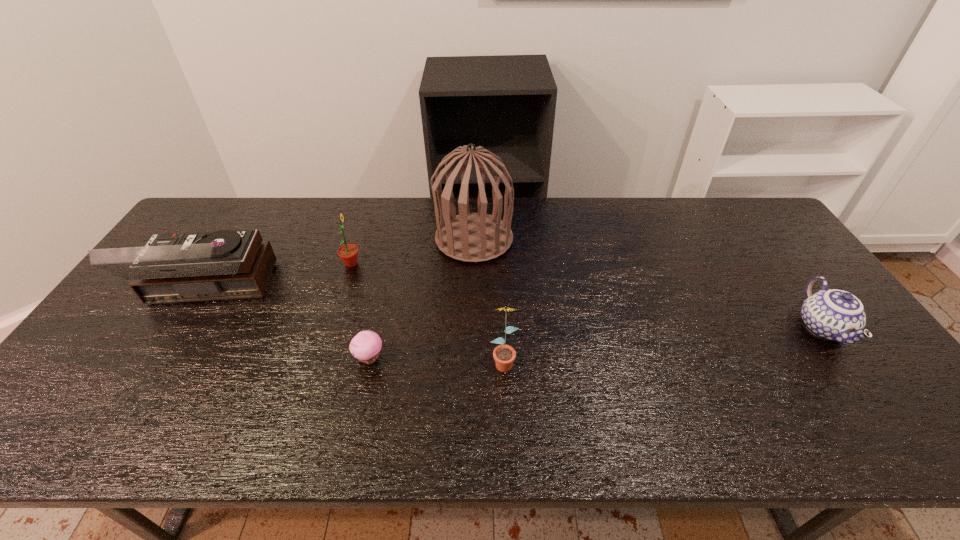
This screenshot has width=960, height=540. What are the coordinates of `vacant space at the near edge of the desktop` in the screenshot? It's located at (769, 418).

In the image, there is a desktop. Identify the location of blank space at the right edge. The image size is (960, 540). (790, 293).

Locate an element on the screen. The width and height of the screenshot is (960, 540). vacant region at the far left corner of the desktop is located at coordinates 205,222.

Locate an element on the screen. free space at the far right corner of the desktop is located at coordinates (736, 199).

At what (x,y) coordinates should I click in order to perform the action: click on free area in between the tallest object and the record player. Please return your answer as a coordinate pair (x, y). The width and height of the screenshot is (960, 540). Looking at the image, I should click on (342, 266).

Locate an element on the screen. vacant space that's between the record player and the tallest object is located at coordinates (342, 266).

You are a GUI agent. You are given a task and a screenshot of the screen. Output one action in this format:
    pyautogui.click(x=<x>, y=<y>)
    Task: Click on the vacant area between the leftmost object and the fifth tallest object
    The width and height of the screenshot is (960, 540).
    Given the screenshot: What is the action you would take?
    pyautogui.click(x=516, y=310)

This screenshot has height=540, width=960. What are the coordinates of `vacant space in between the farther sunflower and the fourth object from right to left` in the screenshot? It's located at point(360,311).

Identify the location of vacant area that lies between the third object from left to right and the left sunflower. The image size is (960, 540). (360, 311).

The image size is (960, 540). What are the coordinates of `vacant space in between the birdcage and the right sunflower` in the screenshot? It's located at (489, 300).